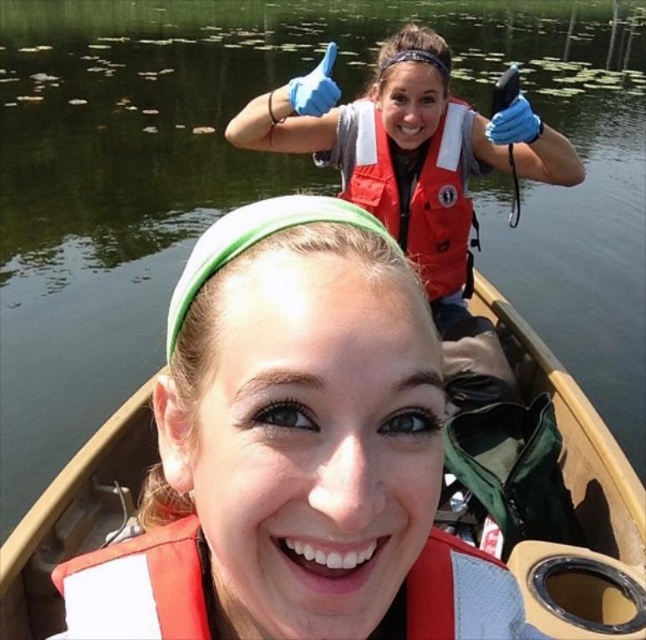
Question: Does matte red life jacket at lower center appear on the left side of red matte life jacket at upper center?

Choices:
 (A) no
 (B) yes

Answer: (B)

Question: Which object is positioned farthest from the red matte life jacket at upper center?

Choices:
 (A) brown wood boat at center
 (B) matte red life jacket at lower center

Answer: (B)

Question: Considering the real-world distances, which object is closest to the red matte life jacket at upper center?

Choices:
 (A) brown wood boat at center
 (B) matte red life jacket at lower center

Answer: (A)

Question: Is brown wood boat at center smaller than red matte life jacket at upper center?

Choices:
 (A) no
 (B) yes

Answer: (B)

Question: Among these objects, which one is nearest to the camera?

Choices:
 (A) red matte life jacket at upper center
 (B) brown wood boat at center

Answer: (B)

Question: Can you confirm if brown wood boat at center is bigger than matte red life jacket at lower center?

Choices:
 (A) no
 (B) yes

Answer: (B)